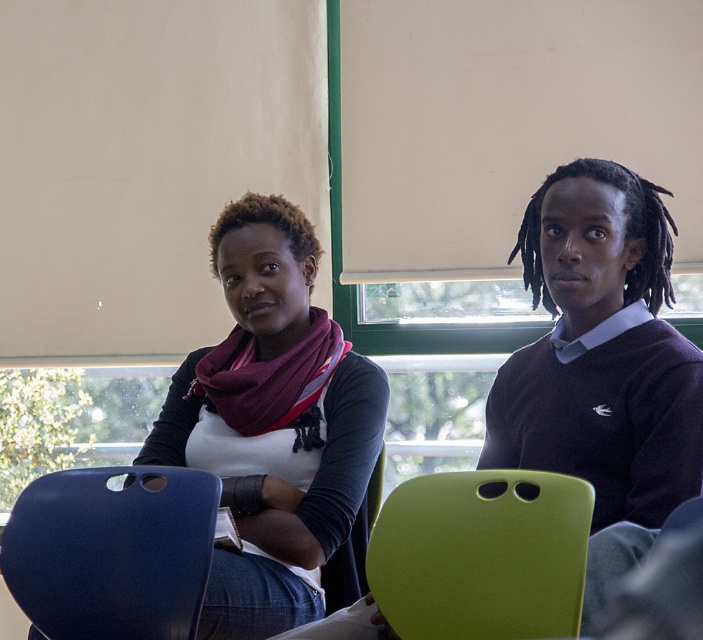
Is point (503, 472) more distant than point (53, 611)?

No, it is in front of (53, 611).

How distant is green matte chair at center from matte blue chair at lower left?

They are 22.08 inches apart.

At what (x,y) coordinates should I click in order to perform the action: click on green matte chair at center. Please return your answer as a coordinate pair (x, y). Image resolution: width=703 pixels, height=640 pixels. Looking at the image, I should click on (482, 554).

You are a GUI agent. You are given a task and a screenshot of the screen. Output one action in this format:
    pyautogui.click(x=<x>, y=<y>)
    Task: Click on the green matte chair at center
    
    Given the screenshot: What is the action you would take?
    point(482,554)

Can you confirm if matte black sweater at center is wider than green matte chair at center?

Yes, matte black sweater at center is wider than green matte chair at center.

Can you confirm if matte black sweater at center is positioned to the right of green matte chair at center?

In fact, matte black sweater at center is to the left of green matte chair at center.

Measure the distance between matte black sweater at center and camera.

2.07 meters

The width and height of the screenshot is (703, 640). I want to click on matte black sweater at center, so click(276, 426).

Does matte black sweater at center have a smaller size compared to matte blue chair at lower left?

Actually, matte black sweater at center might be larger than matte blue chair at lower left.

Who is taller, matte black sweater at center or matte blue chair at lower left?

Standing taller between the two is matte black sweater at center.

Between point (207, 456) and point (109, 536), which one is positioned in front?

Point (109, 536)

Where is `matte black sweater at center`? The width and height of the screenshot is (703, 640). matte black sweater at center is located at coordinates (276, 426).